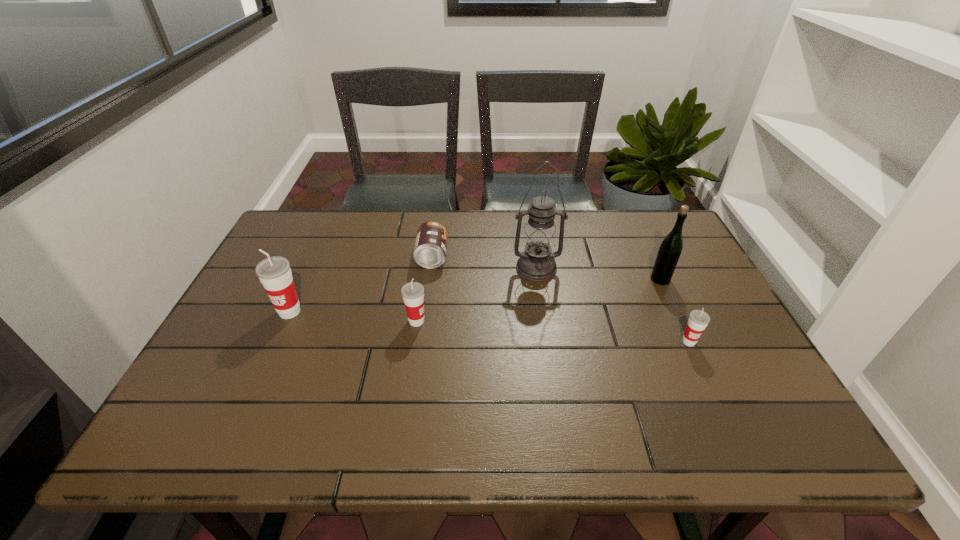
In the image, there is a desktop. Identify the location of vacant space at the far edge. This screenshot has height=540, width=960. (485, 245).

Locate an element on the screen. The height and width of the screenshot is (540, 960). free location at the near edge is located at coordinates (292, 392).

The width and height of the screenshot is (960, 540). I want to click on free space at the left edge, so click(x=289, y=325).

Find the location of `vacant space at the right edge of the desktop`. vacant space at the right edge of the desktop is located at coordinates [x=735, y=364].

This screenshot has height=540, width=960. In the image, there is a desktop. Find the location of `vacant space at the far left corner`. vacant space at the far left corner is located at coordinates (328, 230).

This screenshot has width=960, height=540. What are the coordinates of `free space at the far right corner` in the screenshot? It's located at (627, 225).

Find the location of `free space between the can and the third object from right to left`. free space between the can and the third object from right to left is located at coordinates (484, 262).

At what (x,y) coordinates should I click in order to perform the action: click on vacant point located between the shortest cup and the oil lamp. Please return your answer as a coordinate pair (x, y). The width and height of the screenshot is (960, 540). Looking at the image, I should click on (612, 305).

This screenshot has height=540, width=960. Find the location of `unoccupied area between the third shortest object and the tallest object`. unoccupied area between the third shortest object and the tallest object is located at coordinates (476, 295).

Locate an element on the screen. The width and height of the screenshot is (960, 540). free space that is in between the second cup from left to right and the third object from right to left is located at coordinates (476, 295).